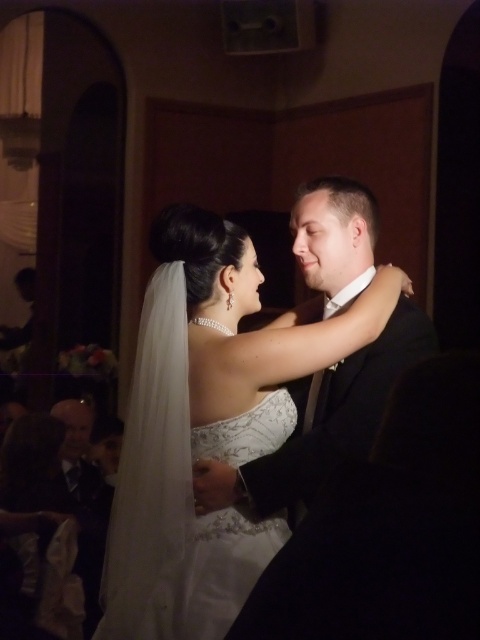
Question: Is white satin dress at center above white lace dress at center?

Choices:
 (A) no
 (B) yes

Answer: (B)

Question: From the image, what is the correct spatial relationship of white satin dress at center in relation to white lace dress at center?

Choices:
 (A) right
 (B) left

Answer: (A)

Question: Which of the following is the closest to the observer?

Choices:
 (A) white satin dress at center
 (B) white lace dress at center

Answer: (B)

Question: Which of the following is the farthest from the observer?

Choices:
 (A) (326, 332)
 (B) (208, 528)

Answer: (A)

Question: Can you confirm if white satin dress at center is thinner than white lace dress at center?

Choices:
 (A) yes
 (B) no

Answer: (B)